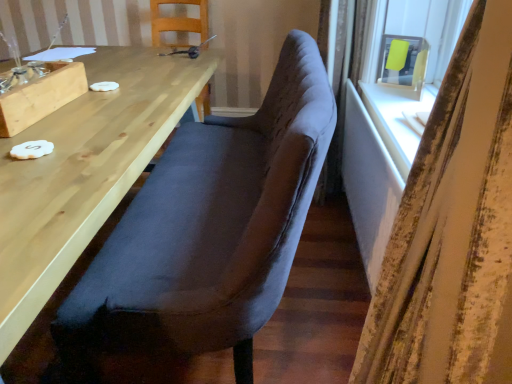
Where is `free space above white painted wood table at right, the 2th table from the left (from a real-world perspective)`? The height and width of the screenshot is (384, 512). free space above white painted wood table at right, the 2th table from the left (from a real-world perspective) is located at coordinates (377, 134).